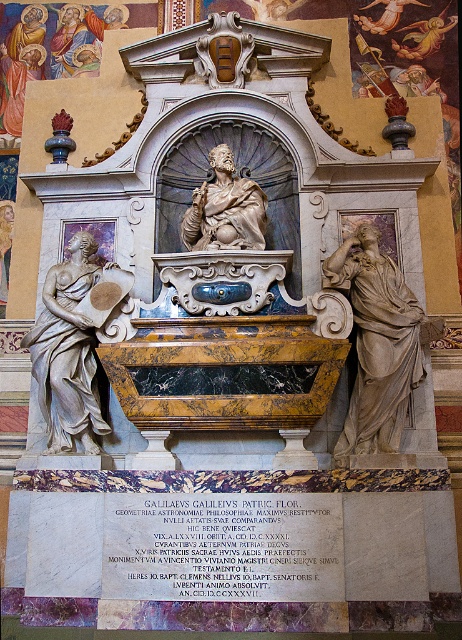
Question: Which is nearer to the matte stone figure at right?

Choices:
 (A) matte stone statue at center
 (B) white marble statue at left

Answer: (A)

Question: Can you confirm if matte stone figure at right is thinner than white marble statue at left?

Choices:
 (A) yes
 (B) no

Answer: (B)

Question: Among these points, which one is farthest from the camera?

Choices:
 (A) (261, 188)
 (B) (66, 376)

Answer: (A)

Question: Which point is farther to the camera?

Choices:
 (A) white marble statue at left
 (B) matte stone figure at right

Answer: (A)

Question: Does matte stone figure at right appear under white marble statue at left?

Choices:
 (A) no
 (B) yes

Answer: (B)

Question: Does matte stone figure at right have a greater width compared to white marble statue at left?

Choices:
 (A) no
 (B) yes

Answer: (B)